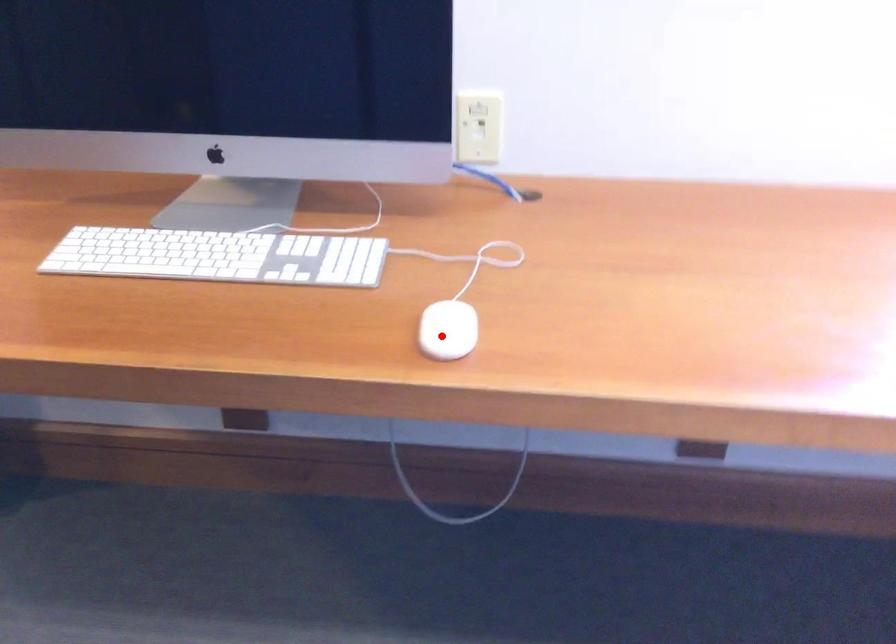
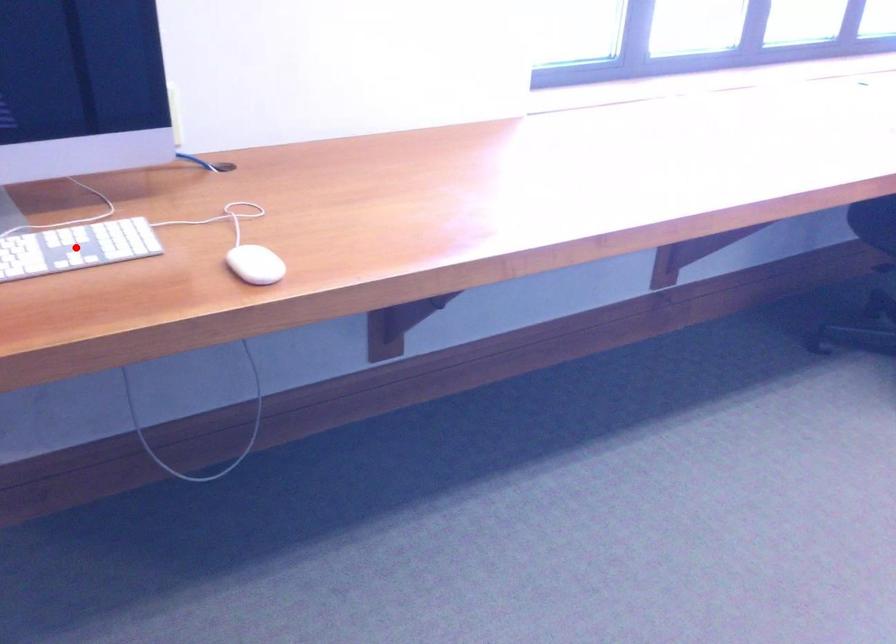
I am providing you with two images of the same scene from different viewpoints. A red point is marked on the first image and another point is marked on the second image. Are the points marked in image1 and image2 representing the same 3D position?

No